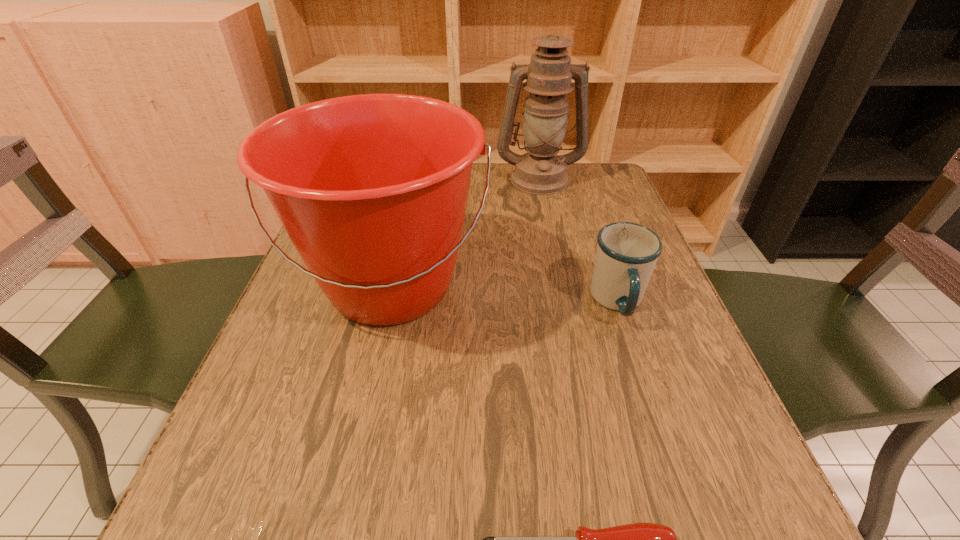
At what (x,y) coordinates should I click in order to perform the action: click on empty space that is in between the mug and the bucket. Please return your answer as a coordinate pair (x, y). Image resolution: width=960 pixels, height=540 pixels. Looking at the image, I should click on (505, 294).

Find the location of `free space that is in between the oil lamp and the bucket`. free space that is in between the oil lamp and the bucket is located at coordinates (466, 232).

Where is `object that ranks as the second closest to the bucket`? This screenshot has width=960, height=540. object that ranks as the second closest to the bucket is located at coordinates (626, 255).

This screenshot has width=960, height=540. I want to click on the closest object to the bucket, so click(540, 171).